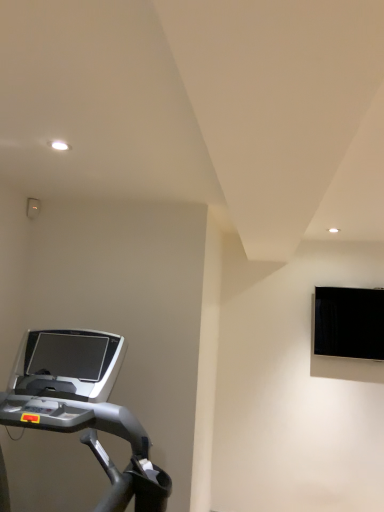
Where is `vacant point above black glossy monitor at upper right (from a real-world perspective)`? vacant point above black glossy monitor at upper right (from a real-world perspective) is located at coordinates (357, 283).